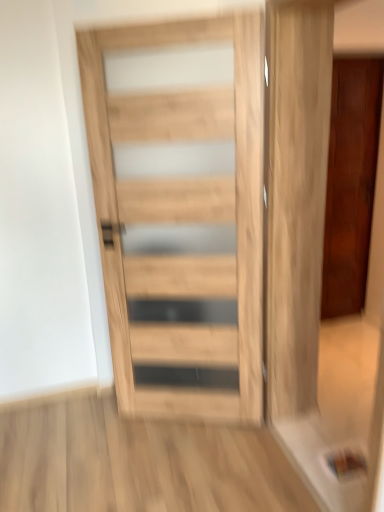
Where is `free location in front of natural wood door at center, the 1th door from the front`? The height and width of the screenshot is (512, 384). free location in front of natural wood door at center, the 1th door from the front is located at coordinates (195, 465).